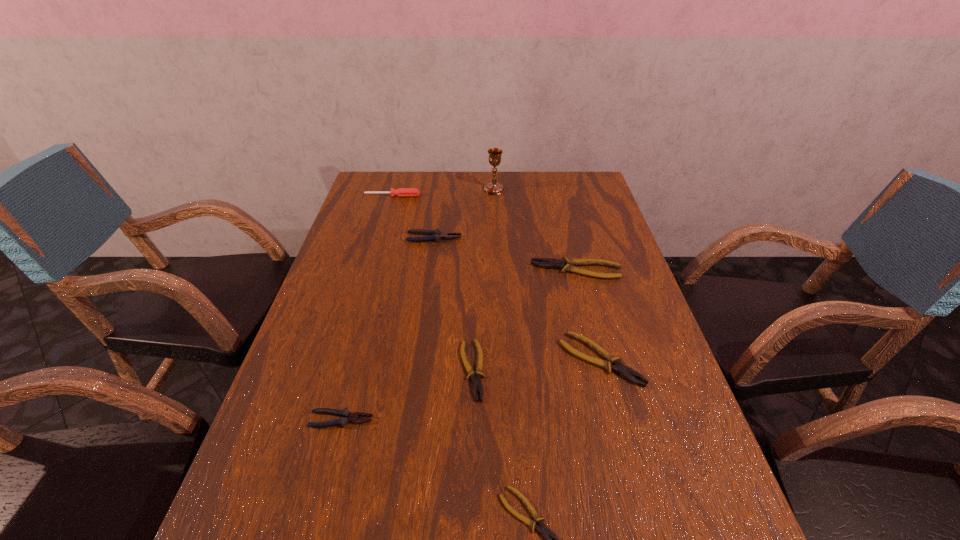
The width and height of the screenshot is (960, 540). What are the coordinates of `chalice` in the screenshot? It's located at (493, 188).

You are a GUI agent. You are given a task and a screenshot of the screen. Output one action in this format:
    pyautogui.click(x=<x>, y=<y>)
    Task: Click on the red screwdriver
    Image resolution: width=960 pixels, height=540 pixels.
    Given the screenshot: What is the action you would take?
    pyautogui.click(x=400, y=192)

The image size is (960, 540). Identify the location of screwdriver. (400, 192).

I want to click on the farthest pliers, so click(435, 235).

Where is `the sixth nearest object`? The height and width of the screenshot is (540, 960). the sixth nearest object is located at coordinates (435, 235).

Find the location of a particular element. The image size is (960, 540). the fifth nearest object is located at coordinates (567, 265).

The height and width of the screenshot is (540, 960). Identify the location of the biggest yellow pliers. (567, 265).

Identify the location of the third smallest yellow pliers. (625, 371).

You are a GUI agent. You are given a task and a screenshot of the screen. Output one action in this format:
    pyautogui.click(x=<x>, y=<y>)
    Task: Click on the seventh farthest object
    The width and height of the screenshot is (960, 540).
    Given the screenshot: What is the action you would take?
    pyautogui.click(x=346, y=416)

Locate an element on the screen. The height and width of the screenshot is (540, 960). the smaller gray pliers is located at coordinates (346, 416).